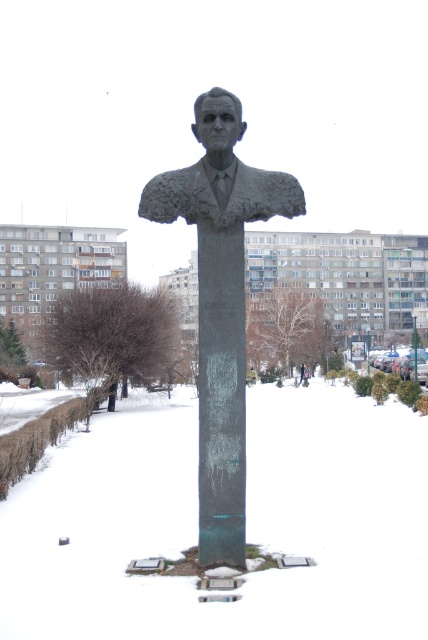
You are standing in the public park and want to take a photo of the statue. You notice two points marked on the ground at coordinates point [130,554] and point [174,189]. Which point should you stand at to ensure the statue is fully visible in your photo without any obstructions?

You should stand at point [174,189] because point [130,554] is behind it, so standing there might block the view of the statue.

Consider the image. You are an art student analyzing the statue in the park. You notice two objects at the center of the image. Which one is bigger between the green patina bust at center and the bronze statue at center?

The green patina bust at center is larger than the bronze statue at center according to the description.

You are standing in the public park depicted in the scene. You want to place a small decorative snowman at the point marked by the coordinates (246, 524). According to the image, what surface will the snowman be placed on?

The point at coordinates (246, 524) corresponds to white frosty snow at center, so the snowman will be placed on the white frosty snow at center.